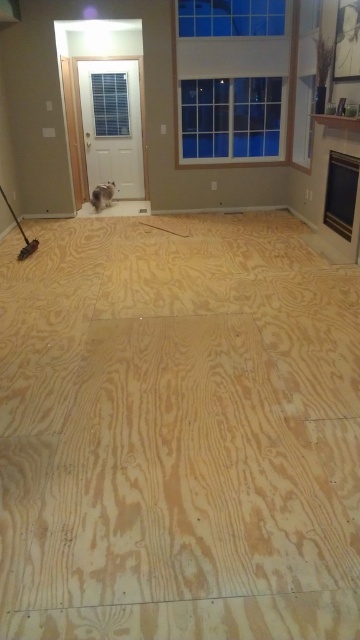
Does natural wood floor at center come in front of white fluffy cat at center?

Yes.

Between natural wood floor at center and white fluffy cat at center, which one has more height?

Standing taller between the two is natural wood floor at center.

Find the location of a particular element. The image size is (360, 640). natural wood floor at center is located at coordinates (177, 432).